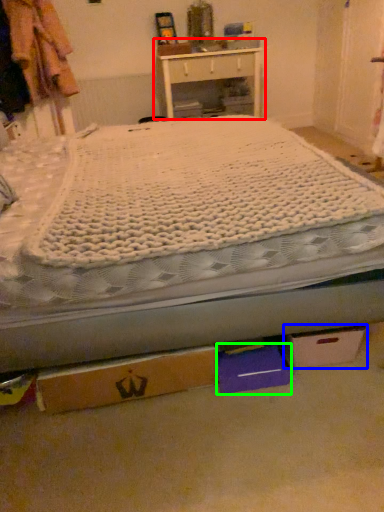
Question: Which object is positioned closest to nightstand (highlighted by a red box)? Select from cardboard box (highlighted by a blue box) and storage box (highlighted by a green box).

Choices:
 (A) cardboard box
 (B) storage box

Answer: (A)